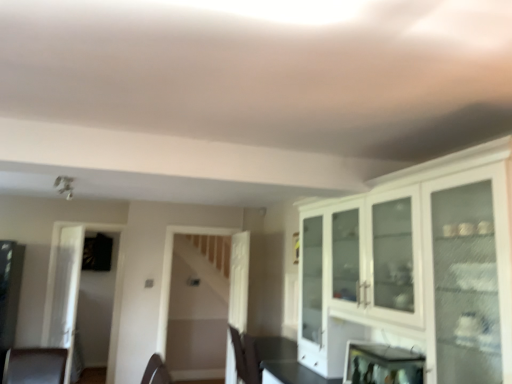
Question: Would you say white glossy cabinet at upper right is to the left or to the right of transparent glass door at left in the picture?

Choices:
 (A) right
 (B) left

Answer: (A)

Question: From the image's perspective, is white glossy cabinet at upper right positioned above or below transparent glass door at left?

Choices:
 (A) above
 (B) below

Answer: (A)

Question: Which of these objects is positioned farthest from the transparent glass door at left?

Choices:
 (A) white glossy cabinet at upper right
 (B) metallic reflective mirror at lower right
 (C) white wood door at center
 (D) brown leather chair at lower left

Answer: (A)

Question: Which object is positioned farthest from the white glossy cabinet at upper right?

Choices:
 (A) transparent glass door at left
 (B) brown leather chair at lower left
 (C) metallic reflective mirror at lower right
 (D) white wood door at center

Answer: (A)